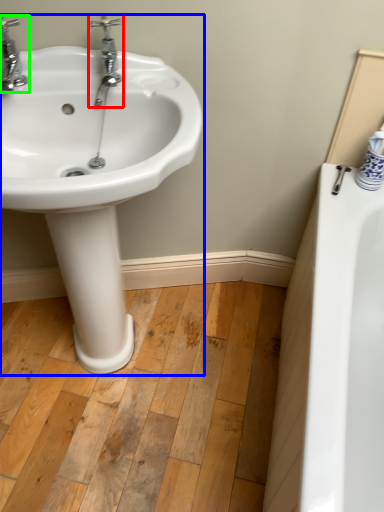
Question: Which object is the farthest from tap (highlighted by a red box)? Choose among these: sink (highlighted by a blue box) or tap (highlighted by a green box).

Choices:
 (A) sink
 (B) tap

Answer: (A)